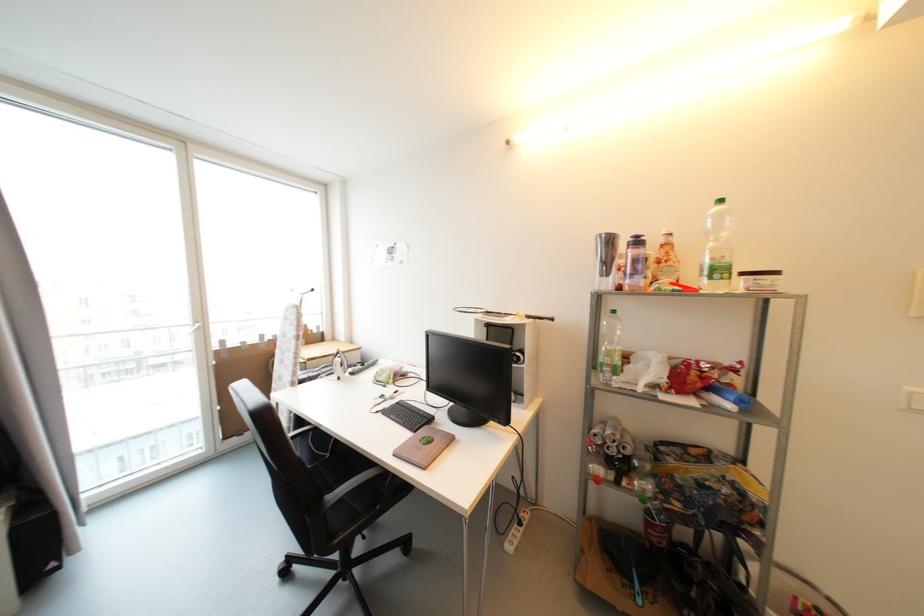
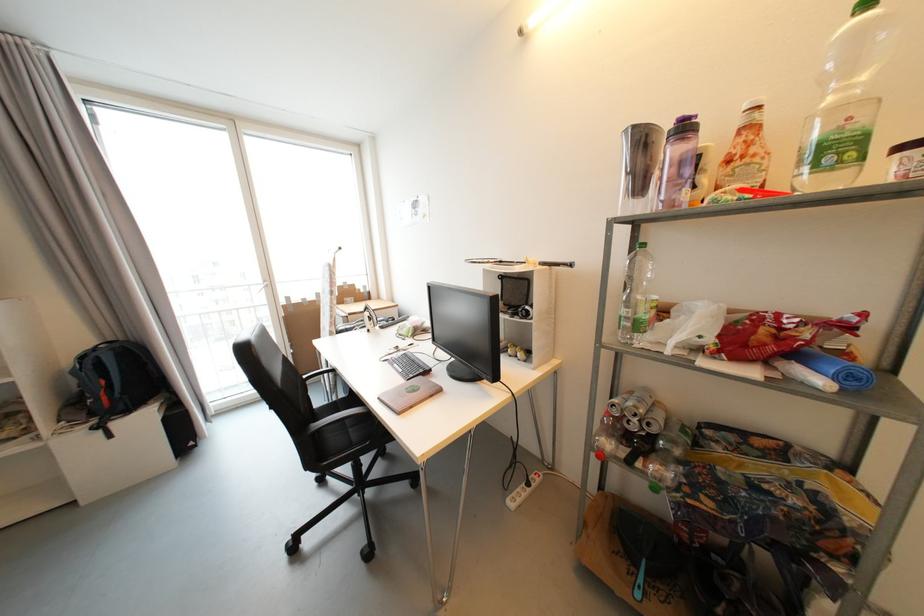
In the second image, find the point that corresponds to point 431,422 in the first image.

(427, 373)